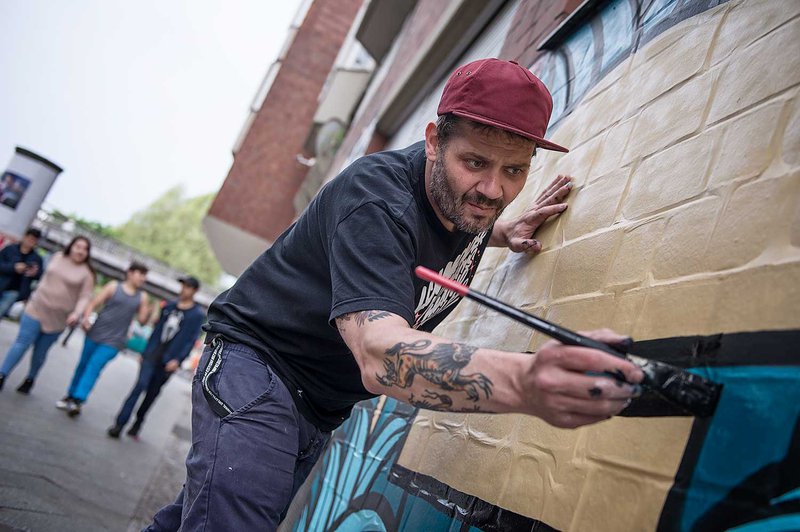
Where is `brown wall`? The image size is (800, 532). brown wall is located at coordinates (686, 174).